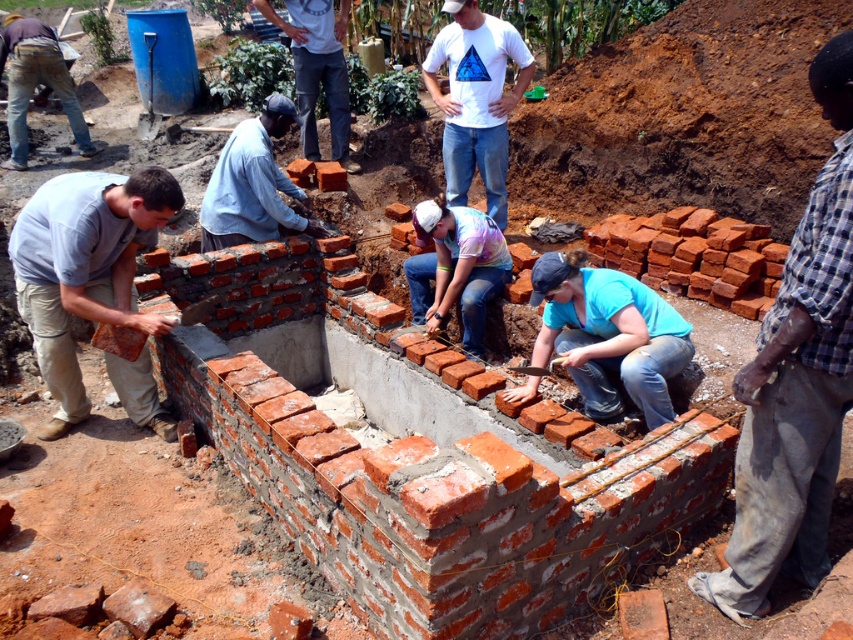
Does checkered fabric shirt at right have a lesser width compared to matte gray brick at left?

Correct, checkered fabric shirt at right's width is less than matte gray brick at left's.

Which is more to the right, checkered fabric shirt at right or matte gray brick at left?

Positioned to the right is checkered fabric shirt at right.

Find the location of a particular element. This screenshot has height=640, width=853. checkered fabric shirt at right is located at coordinates (796, 381).

The image size is (853, 640). What are the coordinates of `checkered fabric shirt at right` in the screenshot? It's located at (796, 381).

Is white matte t-shirt at center wider than light blue shirt at center?

Incorrect, white matte t-shirt at center's width does not surpass light blue shirt at center's.

Is white matte t-shirt at center above light blue shirt at center?

Indeed, white matte t-shirt at center is positioned over light blue shirt at center.

You are a GUI agent. You are given a task and a screenshot of the screen. Output one action in this format:
    pyautogui.click(x=<x>, y=<y>)
    Task: Click on the white matte t-shirt at center
    The height and width of the screenshot is (640, 853).
    Given the screenshot: What is the action you would take?
    pyautogui.click(x=476, y=99)

Who is higher up, matte gray brick at left or light blue shirt at center?

Positioned higher is light blue shirt at center.

Who is more forward, (42, 358) or (257, 134)?

Point (42, 358) is in front.

Locate an element on the screen. matte gray brick at left is located at coordinates (84, 268).

This screenshot has height=640, width=853. Find the location of `matte gray brick at left`. matte gray brick at left is located at coordinates (84, 268).